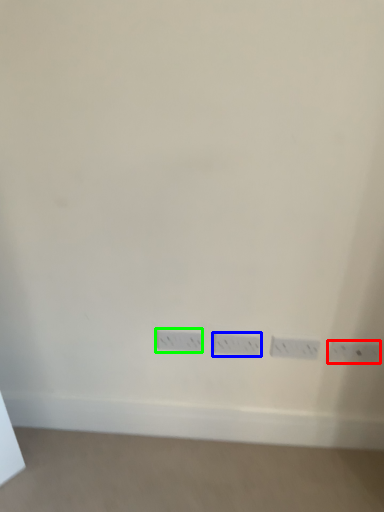
Question: Which object is positioned farthest from power plugs and sockets (highlighted by a red box)? Select from power plugs and sockets (highlighted by a blue box) and power plugs and sockets (highlighted by a green box).

Choices:
 (A) power plugs and sockets
 (B) power plugs and sockets

Answer: (B)